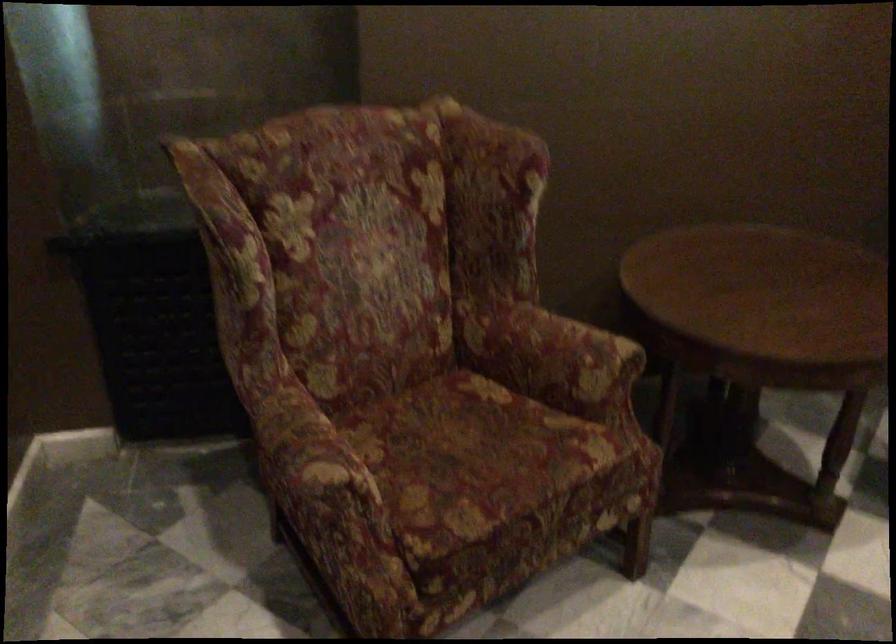
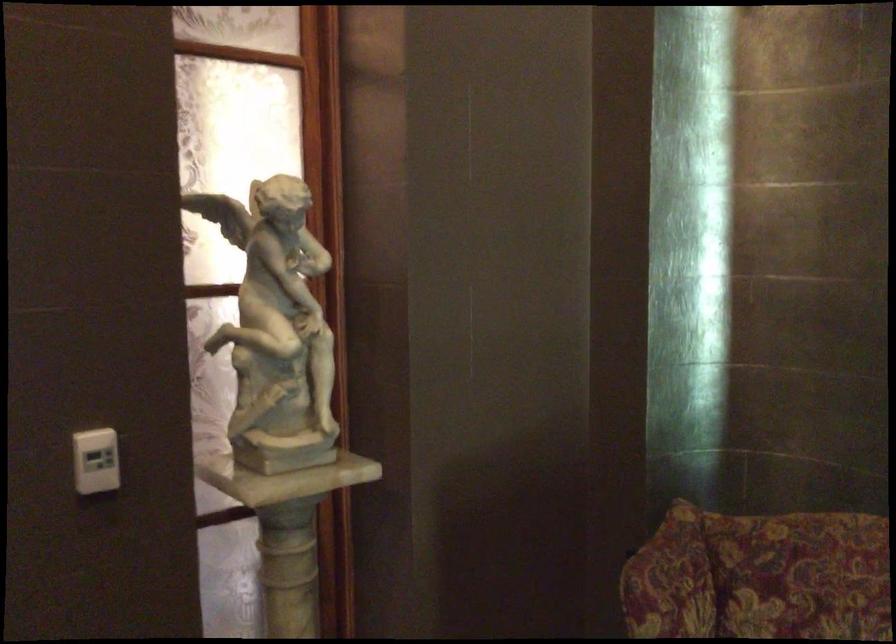
Question: The images are taken continuously from a first-person perspective. In which direction is your viewpoint rotating?

Choices:
 (A) Left
 (B) Right
 (C) Up
 (D) Down

Answer: (A)